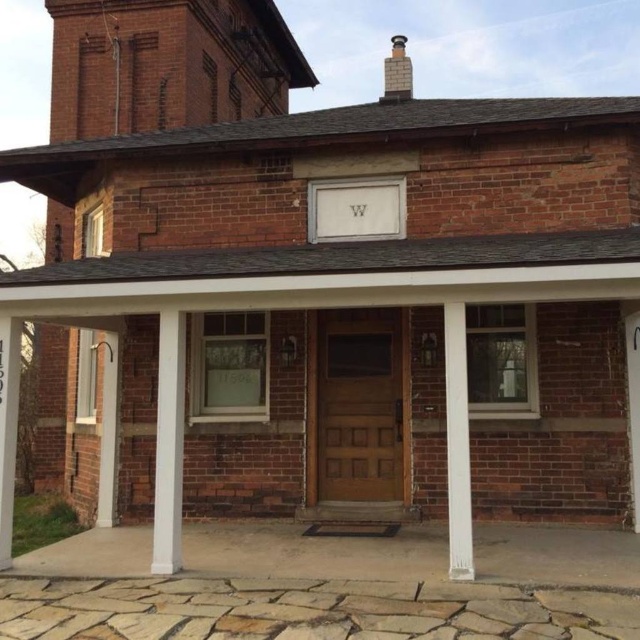
You are a painter who needs to choose between two items to paint next. You have a ladder that can reach up to 2 meters. The white painted wood pillar at center is 1.5 meters wide and the brick chimney at upper center is 2.5 meters wide. Which item can you paint without needing a taller ladder?

The white painted wood pillar at center is 1.5 meters wide, which is narrower than the brick chimney at upper center at 2.5 meters. Since the ladder can reach up to 2 meters, the painter can paint the white painted wood pillar at center without needing a taller ladder because its width is within the ladder reach. However, the brick chimney at upper center is wider than the ladder capacity, so it requires a taller ladder.

You are standing in front of the building and want to reach the front door. Which object should you pass by first, the white smooth column at center or the white painted wood pillar at center?

The white smooth column at center is located below the white painted wood pillar at center, so you will pass by the white smooth column at center first as it is closer to the entrance.